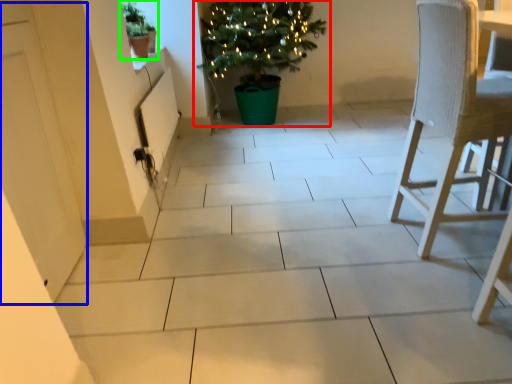
Question: Which is farther away from houseplant (highlighted by a red box)? screen door (highlighted by a blue box) or houseplant (highlighted by a green box)?

Choices:
 (A) screen door
 (B) houseplant

Answer: (A)